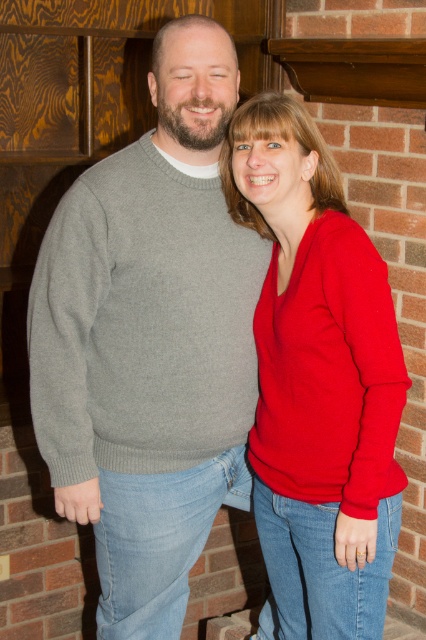
Question: Is gray sweater at center further to camera compared to red matte sweater at center?

Choices:
 (A) yes
 (B) no

Answer: (A)

Question: Observing the image, what is the correct spatial positioning of gray sweater at center in reference to red matte sweater at center?

Choices:
 (A) above
 (B) below

Answer: (A)

Question: Does gray sweater at center appear over red matte sweater at center?

Choices:
 (A) yes
 (B) no

Answer: (A)

Question: Among these objects, which one is nearest to the camera?

Choices:
 (A) red matte sweater at center
 (B) gray sweater at center

Answer: (A)

Question: Which of the following is the closest to the observer?

Choices:
 (A) (317, 518)
 (B) (138, 280)

Answer: (B)